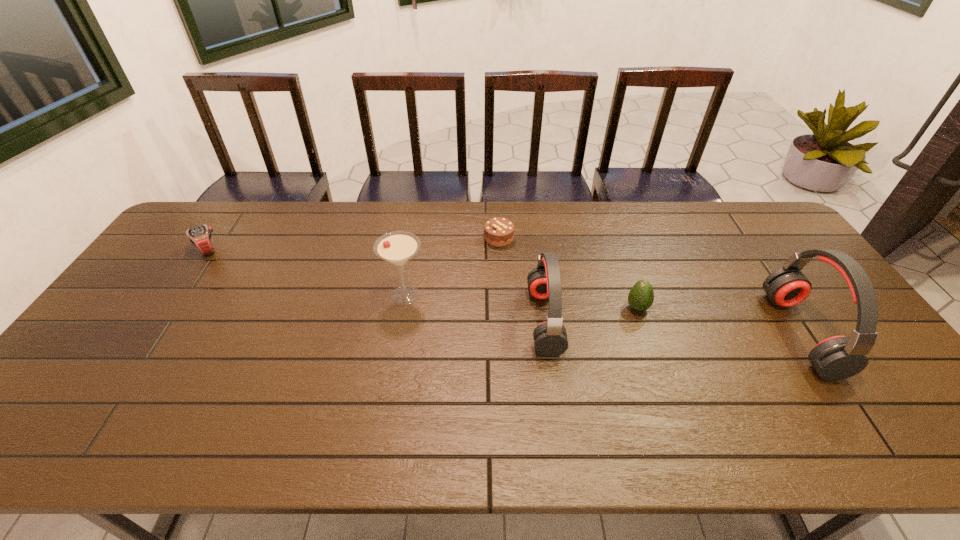
Find the location of `vacant space in between the fourth object from right to left and the avocado`. vacant space in between the fourth object from right to left and the avocado is located at coordinates (568, 273).

Identify the location of vacant area that lies between the martini and the taller earphone. (603, 314).

At what (x,y) coordinates should I click in order to perform the action: click on vacant region between the third object from left to right and the third shortest object. Please return your answer as a coordinate pair (x, y). The image size is (960, 540). Looking at the image, I should click on (568, 273).

Where is `free space between the chocolate cake and the leftmost object`? free space between the chocolate cake and the leftmost object is located at coordinates (353, 244).

At what (x,y) coordinates should I click in order to perform the action: click on vacant area that lies between the third object from right to left and the chocolate cake. Please return your answer as a coordinate pair (x, y). The width and height of the screenshot is (960, 540). Looking at the image, I should click on (522, 279).

The height and width of the screenshot is (540, 960). I want to click on vacant area between the fourth object from left to right and the leftmost object, so click(376, 285).

Where is `vacant area between the fifth object from right to left and the fourth object from left to right`? The height and width of the screenshot is (540, 960). vacant area between the fifth object from right to left and the fourth object from left to right is located at coordinates (475, 308).

Locate which object ranks fifth in proximity to the second object from right to left. Please provide its 2D coordinates. Your answer should be formatted as a tuple, i.e. [(x, y)], where the tuple contains the x and y coordinates of a point satisfying the conditions above.

[(200, 236)]

Identify the location of the second closest object to the fifth object from left to right. Image resolution: width=960 pixels, height=540 pixels. (836, 358).

At what (x,y) coordinates should I click in order to perform the action: click on blank space that satisfies the following two spatial constraints: 1. on the front side of the fifth object from left to right; 2. on the left side of the second object from left to right. Please return your answer as a coordinate pair (x, y). The height and width of the screenshot is (540, 960). Looking at the image, I should click on (403, 308).